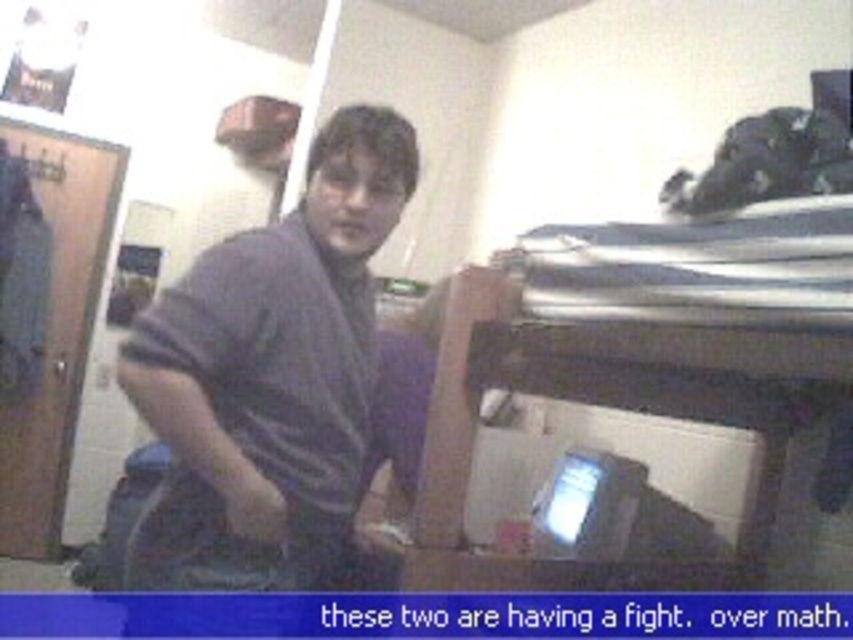
Based on the scene description, can you determine the spatial relationship between the metallic silver bunk bed at right and the dark gray cotton shirt at center?

The metallic silver bunk bed at right is positioned below the dark gray cotton shirt at center.

Based on the photo, you are standing in a room and want to place a 36 inch wide poster on the wall behind the metallic silver bunk bed at right. Is there enough space between you and the bunk bed to safely hang the poster?

The distance between you and the metallic silver bunk bed at right is 35.49 inches. Since the poster is 36 inches wide, there isn not enough space to safely hang it as the distance is slightly less than the poster width.